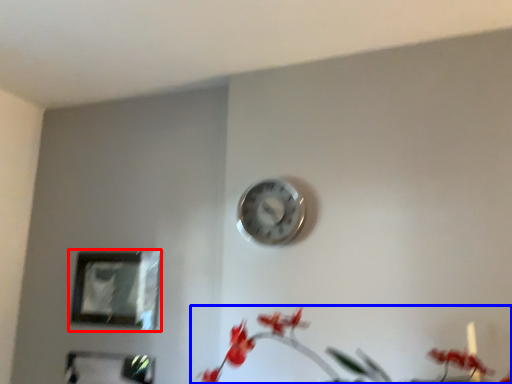
Question: Which object is closer to the camera taking this photo, picture frame (highlighted by a red box) or floral arrangement (highlighted by a blue box)?

Choices:
 (A) picture frame
 (B) floral arrangement

Answer: (B)